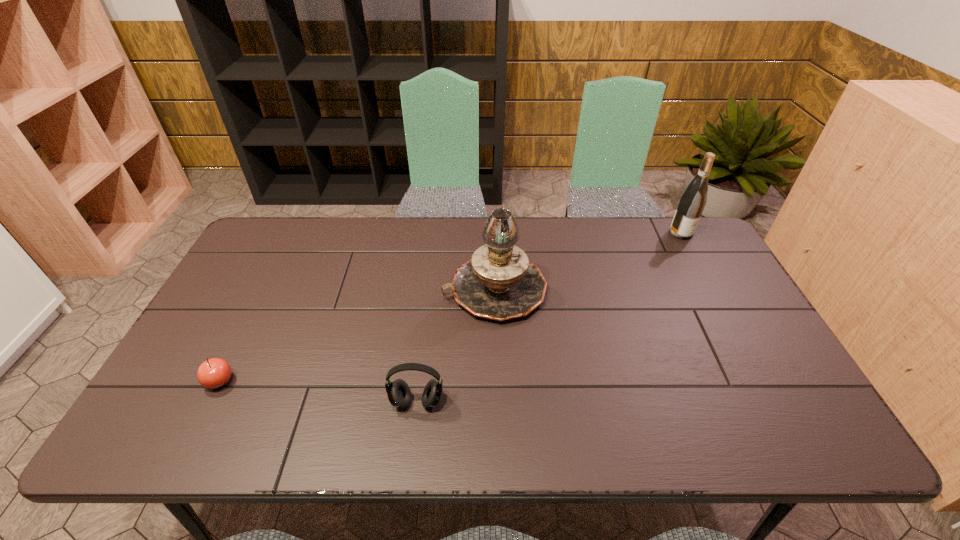
You are a GUI agent. You are given a task and a screenshot of the screen. Output one action in this format:
    pyautogui.click(x=<x>, y=<y>)
    Task: Click on the vacant space at the near left corner
    Image resolution: width=960 pixels, height=540 pixels.
    Given the screenshot: What is the action you would take?
    pyautogui.click(x=212, y=427)

In the image, there is a desktop. What are the coordinates of `vacant space at the far right corner` in the screenshot? It's located at (673, 247).

This screenshot has height=540, width=960. What are the coordinates of `empty space between the farthest object and the third nearest object` in the screenshot? It's located at [588, 261].

In order to click on empty space between the shortest object and the headset in this screenshot , I will do `click(319, 391)`.

The image size is (960, 540). I want to click on empty space that is in between the wine bottle and the third nearest object, so click(588, 261).

I want to click on free space that is in between the third nearest object and the rightmost object, so click(x=588, y=261).

Where is `vacant space that is in between the oil lamp and the farthest object`? This screenshot has height=540, width=960. vacant space that is in between the oil lamp and the farthest object is located at coordinates (588, 261).

Where is `free point between the rightmost object and the oil lamp`? free point between the rightmost object and the oil lamp is located at coordinates (588, 261).

Locate an element on the screen. The width and height of the screenshot is (960, 540). vacant point located between the third nearest object and the headset is located at coordinates (456, 346).

Locate an element on the screen. unoccupied position between the leftmost object and the third tallest object is located at coordinates (319, 391).